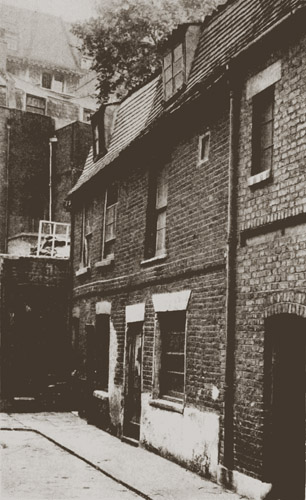
This screenshot has width=306, height=500. Find the location of `top floor windowsill`. top floor windowsill is located at coordinates (81, 270), (108, 262), (155, 260), (257, 181).